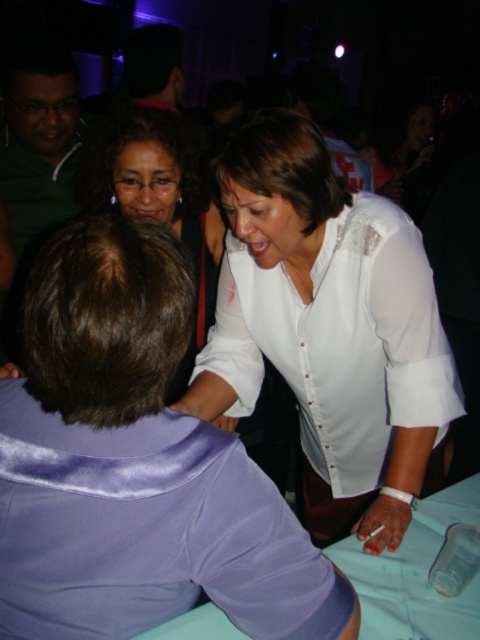
You are at a party and need to decide whether to place a decorative item on the green matte shirt at upper left or the clear plastic bottle at lower right. Which surface is wider?

The green matte shirt at upper left might be wider than clear plastic bottle at lower right, so it is more likely to be the wider surface for placing the decorative item.

You are at a party and want to find the green matte shirt at upper left. You notice a point marked at coordinates [37,138]. Where is this point located?

The point at [37,138] is located on the green matte shirt at upper left.

You are at a party and want to take a photo of both the white satin blouse at center and the green matte shirt at upper left. Which one should you focus on first to ensure both are in clear focus?

You should focus on the white satin blouse at center first because it is closer to the viewer than the green matte shirt at upper left, so adjusting focus from near to far will help both be in focus.